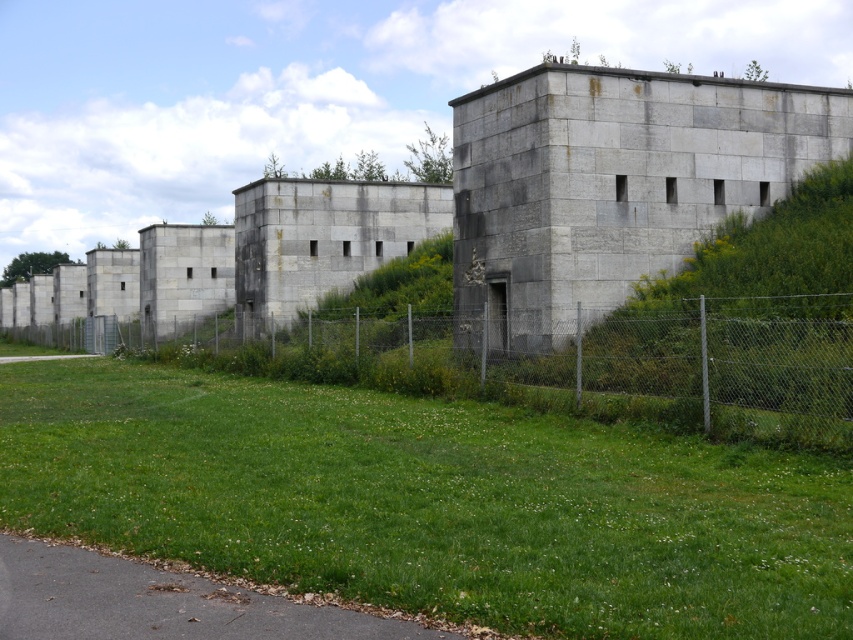
Question: In this image, where is gray concrete building at center located relative to metal chain-link fence at center?

Choices:
 (A) below
 (B) above

Answer: (B)

Question: Among these objects, which one is farthest from the camera?

Choices:
 (A) gray concrete building at center
 (B) green grass at lower center
 (C) metal chain-link fence at center

Answer: (A)

Question: Does green grass at lower center have a larger size compared to metal chain-link fence at center?

Choices:
 (A) yes
 (B) no

Answer: (B)

Question: Considering the real-world distances, which object is closest to the metal chain-link fence at center?

Choices:
 (A) gray concrete building at center
 (B) green grass at lower center

Answer: (B)

Question: Which object appears farthest from the camera in this image?

Choices:
 (A) gray concrete building at center
 (B) metal chain-link fence at center
 (C) green grass at lower center

Answer: (A)

Question: Does gray concrete building at center appear over metal chain-link fence at center?

Choices:
 (A) yes
 (B) no

Answer: (A)